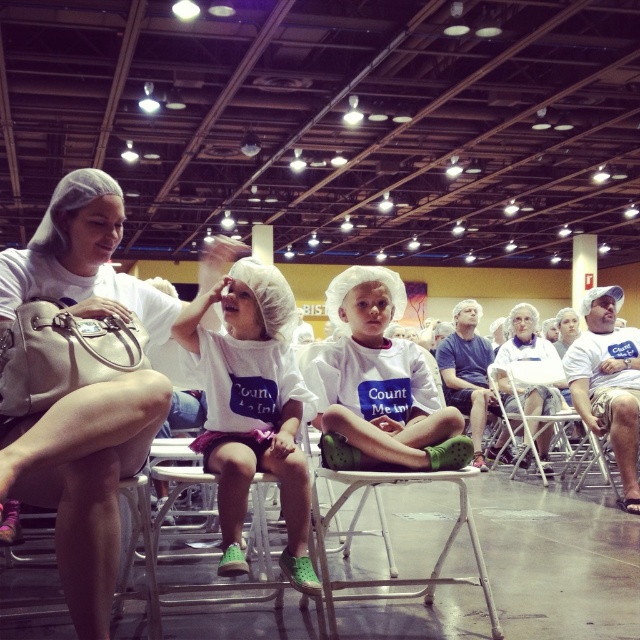
You are a photographer setting up for a group photo. You notice the matte white hairnet at upper left and the metallic silver folding chair at center in your frame. Which object will appear larger in your photo?

The matte white hairnet at upper left will appear larger in the photo because it is much taller than the metallic silver folding chair at center.

You are a photographer setting up for an event. You notice the matte white hairnet at upper left and the metallic silver folding chair at center. Which object is positioned higher in the image?

The matte white hairnet at upper left is above the metallic silver folding chair at center, so it is positioned higher in the image.

You are a photographer setting up for a group photo. You notice the matte white hairnet at upper left and the metallic silver folding chair at center in your frame. Which object should you adjust to ensure both are clearly visible, and why?

You should adjust the matte white hairnet at upper left because it is bigger than the metallic silver folding chair at center and might dominate the frame, making the chair less visible.